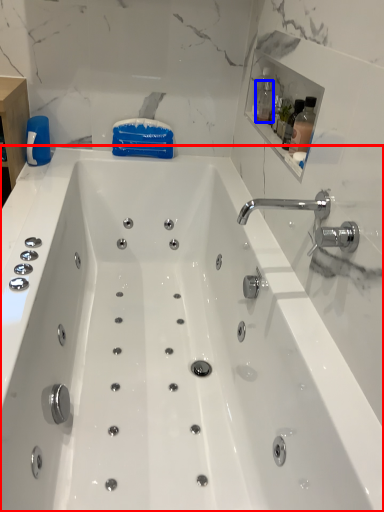
Question: Which object is closer to the camera taking this photo, bathtub (highlighted by a red box) or bottle (highlighted by a blue box)?

Choices:
 (A) bathtub
 (B) bottle

Answer: (A)